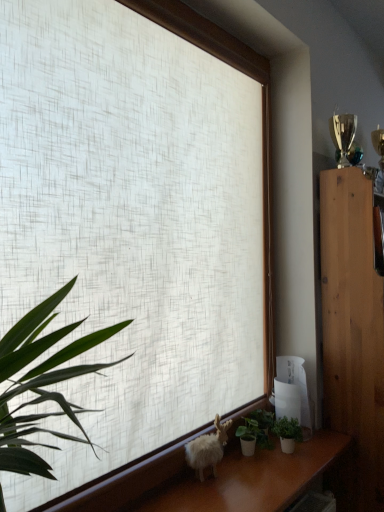
The height and width of the screenshot is (512, 384). Find the location of `white textured fabric at center`. white textured fabric at center is located at coordinates (123, 238).

What is the approximate width of white textured fabric at center?

It is 19.07 inches.

This screenshot has width=384, height=512. Describe the element at coordinates (248, 436) in the screenshot. I see `green matte houseplant at lower center, marked as the first houseplant in a left-to-right arrangement` at that location.

Describe the element at coordinates (353, 333) in the screenshot. I see `wooden cabinet at right` at that location.

Find the location of a particular element. green matte plant at lower right, which is counted as the 2th houseplant, starting from the left is located at coordinates pyautogui.click(x=287, y=433).

Can you confirm if wooden cabinet at right is taller than white fluffy goat at lower center?

Correct, wooden cabinet at right is much taller as white fluffy goat at lower center.

Is wooden cabinet at right further to camera compared to white fluffy goat at lower center?

That is True.

Does point (328, 351) lie behind point (204, 440)?

Yes, point (328, 351) is behind point (204, 440).

Does wooden cabinet at right contain white fluffy goat at lower center?

Definitely not — white fluffy goat at lower center is not inside wooden cabinet at right.

Considering the relative positions of white textured fabric at center and wooden cabinet at right in the image provided, is white textured fabric at center to the left of wooden cabinet at right from the viewer's perspective?

Indeed, white textured fabric at center is positioned on the left side of wooden cabinet at right.

In the image, is white textured fabric at center positioned in front of or behind wooden cabinet at right?

Clearly, white textured fabric at center is in front of wooden cabinet at right.

Considering the sizes of white textured fabric at center and wooden cabinet at right in the image, is white textured fabric at center wider or thinner than wooden cabinet at right?

white textured fabric at center is wider than wooden cabinet at right.

Could you tell me if white textured fabric at center is turned towards wooden cabinet at right?

No.

Which object is further away from the camera, green matte houseplant at lower center, which is counted as the second houseplant, starting from the right, or green matte plant at lower right, which is counted as the 2th houseplant, starting from the left?

green matte plant at lower right, which is counted as the 2th houseplant, starting from the left.

Identify the location of houseplant lying in front of the green matte plant at lower right, which is counted as the 2th houseplant, starting from the left. (248, 436).

Which is closer to the camera, [255,441] or [293,423]?

The point [255,441] is more forward.

Based on the photo, from a real-world perspective, is green matte houseplant at lower center, marked as the first houseplant in a left-to-right arrangement, over green matte plant at lower right, which is counted as the 2th houseplant, starting from the left?

No, from a real-world perspective, green matte houseplant at lower center, marked as the first houseplant in a left-to-right arrangement, is not over green matte plant at lower right, which is counted as the 2th houseplant, starting from the left

Who is shorter, green matte houseplant at lower center, marked as the first houseplant in a left-to-right arrangement, or white textured fabric at center?

green matte houseplant at lower center, marked as the first houseplant in a left-to-right arrangement, is shorter.

From the image's perspective, would you say green matte houseplant at lower center, which is counted as the second houseplant, starting from the right, is positioned over white textured fabric at center?

No.

Are green matte houseplant at lower center, marked as the first houseplant in a left-to-right arrangement, and white textured fabric at center far apart?

No, green matte houseplant at lower center, marked as the first houseplant in a left-to-right arrangement, is not far away from white textured fabric at center.

Is green matte houseplant at lower center, which is counted as the second houseplant, starting from the right, smaller than white textured fabric at center?

Yes.

Between green matte plant at lower right, which is counted as the 2th houseplant, starting from the left, and white textured fabric at center, which one has larger width?

With larger width is white textured fabric at center.

From the image's perspective, which object appears higher, green matte plant at lower right, which is the first houseplant from right to left, or white textured fabric at center?

white textured fabric at center, from the image's perspective.

Considering the relative positions of green matte plant at lower right, which is the first houseplant from right to left, and white textured fabric at center in the image provided, is green matte plant at lower right, which is the first houseplant from right to left, to the left of white textured fabric at center from the viewer's perspective?

No.

Does green matte plant at lower right, which is counted as the 2th houseplant, starting from the left, have a smaller size compared to white textured fabric at center?

Correct, green matte plant at lower right, which is counted as the 2th houseplant, starting from the left, occupies less space than white textured fabric at center.

Does point (221, 425) appear closer or farther from the camera than point (383, 415)?

Point (221, 425).

How much distance is there between white fluffy goat at lower center and wooden cabinet at right?

white fluffy goat at lower center and wooden cabinet at right are 27.83 inches apart from each other.

Is white fluffy goat at lower center looking in the opposite direction of wooden cabinet at right?

white fluffy goat at lower center is not turned away from wooden cabinet at right.

From the picture: Does white fluffy goat at lower center appear on the right side of wooden cabinet at right?

No, white fluffy goat at lower center is not to the right of wooden cabinet at right.

From a real-world perspective, is white textured fabric at center physically above green matte houseplant at lower center, marked as the first houseplant in a left-to-right arrangement?

Yes, from a real-world perspective, white textured fabric at center is above green matte houseplant at lower center, marked as the first houseplant in a left-to-right arrangement.

Are white textured fabric at center and green matte houseplant at lower center, marked as the first houseplant in a left-to-right arrangement, far apart?

No, white textured fabric at center is not far from green matte houseplant at lower center, marked as the first houseplant in a left-to-right arrangement.

At what (x,y) coordinates should I click in order to perform the action: click on window above the green matte houseplant at lower center, which is counted as the second houseplant, starting from the right (from the image's perspective). Please return your answer as a coordinate pair (x, y). Image resolution: width=384 pixels, height=512 pixels. Looking at the image, I should click on (123, 238).

Is white textured fabric at center at the right side of green matte houseplant at lower center, which is counted as the second houseplant, starting from the right?

No, white textured fabric at center is not to the right of green matte houseplant at lower center, which is counted as the second houseplant, starting from the right.

At what (x,y) coordinates should I click in order to perform the action: click on animal that is under the wooden cabinet at right (from a real-world perspective). Please return your answer as a coordinate pair (x, y). Looking at the image, I should click on (207, 449).

Find the location of a particular element. Image resolution: width=384 pixels, height=512 pixels. furniture to the right of white textured fabric at center is located at coordinates (353, 333).

Which object lies further to the anchor point wooden cabinet at right, green matte plant at lower right, which is counted as the 2th houseplant, starting from the left, or white textured fabric at center?

white textured fabric at center.

Estimate the real-world distances between objects in this image. Which object is further from green matte plant at lower right, which is the first houseplant from right to left, green matte houseplant at lower center, which is counted as the second houseplant, starting from the right, or white fluffy goat at lower center?

Based on the image, white fluffy goat at lower center appears to be further to green matte plant at lower right, which is the first houseplant from right to left.

Considering their positions, is white textured fabric at center positioned further to green matte houseplant at lower center, which is counted as the second houseplant, starting from the right, than green matte plant at lower right, which is counted as the 2th houseplant, starting from the left?

Based on the image, white textured fabric at center appears to be further to green matte houseplant at lower center, which is counted as the second houseplant, starting from the right.

From the image, which object appears to be farther from wooden cabinet at right, white fluffy goat at lower center or white textured fabric at center?

white textured fabric at center.

Estimate the real-world distances between objects in this image. Which object is further from green matte houseplant at lower center, which is counted as the second houseplant, starting from the right, green matte plant at lower right, which is counted as the 2th houseplant, starting from the left, or white fluffy goat at lower center?

The object further to green matte houseplant at lower center, which is counted as the second houseplant, starting from the right, is white fluffy goat at lower center.

When comparing their distances from white fluffy goat at lower center, does green matte houseplant at lower center, marked as the first houseplant in a left-to-right arrangement, or wooden cabinet at right seem further?

The object further to white fluffy goat at lower center is wooden cabinet at right.

Based on their spatial positions, is wooden cabinet at right or white textured fabric at center further from white fluffy goat at lower center?

Among the two, wooden cabinet at right is located further to white fluffy goat at lower center.

Based on their spatial positions, is wooden cabinet at right or green matte houseplant at lower center, marked as the first houseplant in a left-to-right arrangement, closer to green matte plant at lower right, which is the first houseplant from right to left?

green matte houseplant at lower center, marked as the first houseplant in a left-to-right arrangement, is closer to green matte plant at lower right, which is the first houseplant from right to left.

At what (x,y) coordinates should I click in order to perform the action: click on houseplant situated between green matte houseplant at lower center, marked as the first houseplant in a left-to-right arrangement, and wooden cabinet at right from left to right. Please return your answer as a coordinate pair (x, y). This screenshot has width=384, height=512. Looking at the image, I should click on (287, 433).

Where is `animal between white textured fabric at center and green matte houseplant at lower center, marked as the first houseplant in a left-to-right arrangement, from front to back`? The width and height of the screenshot is (384, 512). animal between white textured fabric at center and green matte houseplant at lower center, marked as the first houseplant in a left-to-right arrangement, from front to back is located at coordinates (207, 449).

Identify the location of animal positioned between white textured fabric at center and green matte plant at lower right, which is counted as the 2th houseplant, starting from the left, from near to far. This screenshot has width=384, height=512. (207, 449).

I want to click on houseplant located between white textured fabric at center and green matte plant at lower right, which is the first houseplant from right to left, in the depth direction, so click(248, 436).